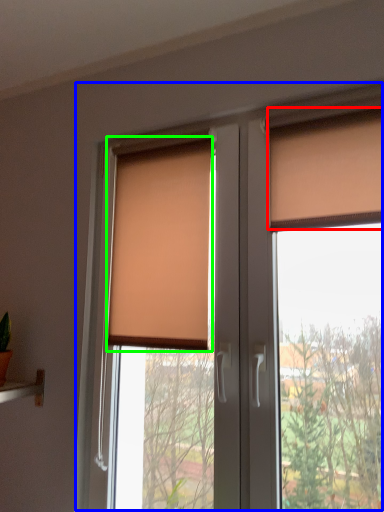
Question: Considering the real-world distances, which object is closest to curtain (highlighted by a red box)? window (highlighted by a blue box) or window blind (highlighted by a green box).

Choices:
 (A) window
 (B) window blind

Answer: (A)